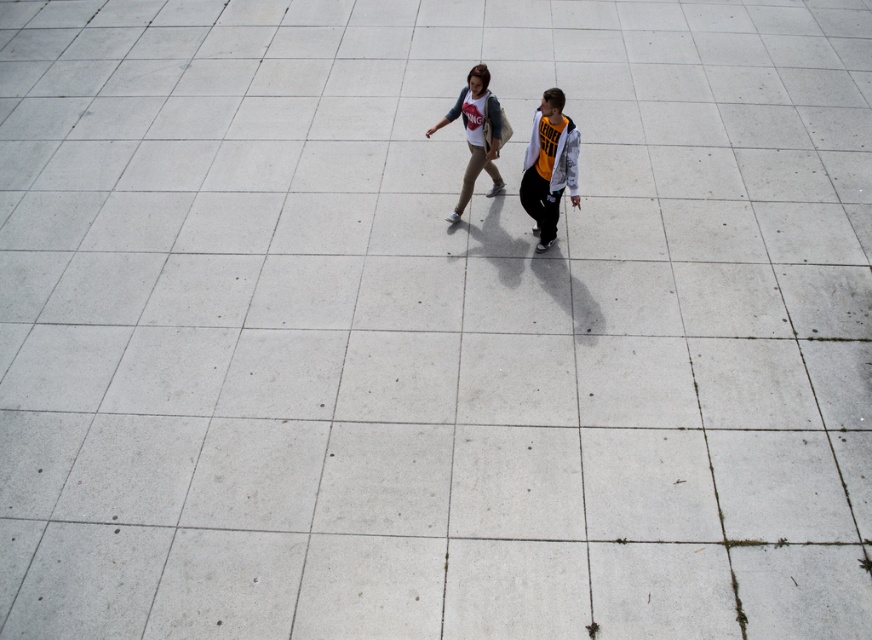
This screenshot has height=640, width=872. What do you see at coordinates (549, 164) in the screenshot?
I see `orange jersey at center` at bounding box center [549, 164].

Can you confirm if orange jersey at center is bigger than matte white shirt at center?

No, orange jersey at center is not bigger than matte white shirt at center.

This screenshot has width=872, height=640. Find the location of `orange jersey at center`. orange jersey at center is located at coordinates (549, 164).